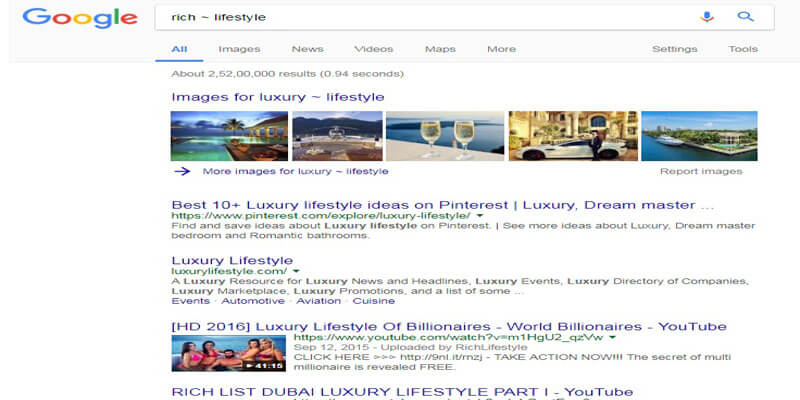
At what (x,y) coordinates should I click in order to perform the action: click on wine glass. Please return your answer as a coordinate pair (x, y). Looking at the image, I should click on (430, 135), (462, 131).